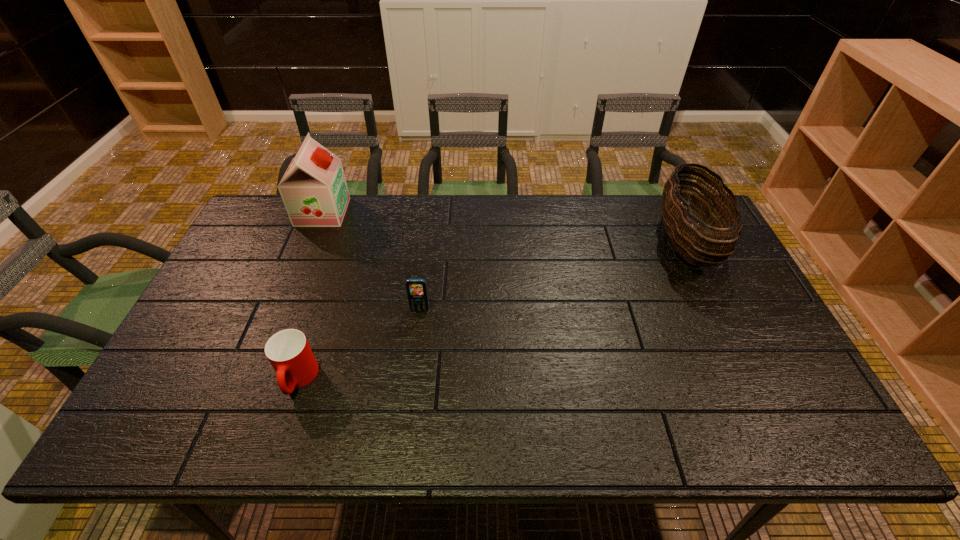
At what (x,y) coordinates should I click in order to perform the action: click on soya milk located in the far edge section of the desktop. Please return your answer as a coordinate pair (x, y). The image size is (960, 540). Looking at the image, I should click on (314, 191).

This screenshot has width=960, height=540. Identify the location of basket situated at the far edge. (684, 235).

You are a GUI agent. You are given a task and a screenshot of the screen. Output one action in this format:
    pyautogui.click(x=<x>, y=<y>)
    Task: Click on the object at the left edge
    This screenshot has width=960, height=540.
    Given the screenshot: What is the action you would take?
    pyautogui.click(x=314, y=191)

Where is `object present at the right edge`? object present at the right edge is located at coordinates (x=684, y=235).

Image resolution: width=960 pixels, height=540 pixels. What are the coordinates of `object present at the far left corner` in the screenshot? It's located at (314, 191).

The width and height of the screenshot is (960, 540). I want to click on object present at the far right corner, so click(684, 235).

Find the location of a particular element. free point at the far edge is located at coordinates (296, 238).

In the image, there is a desktop. What are the coordinates of `free space at the near edge` in the screenshot? It's located at (615, 441).

In the image, there is a desktop. Identify the location of vacant space at the left edge. The image size is (960, 540). (205, 406).

Find the location of a particular element. Image resolution: width=960 pixels, height=540 pixels. free space at the right edge of the desktop is located at coordinates (797, 404).